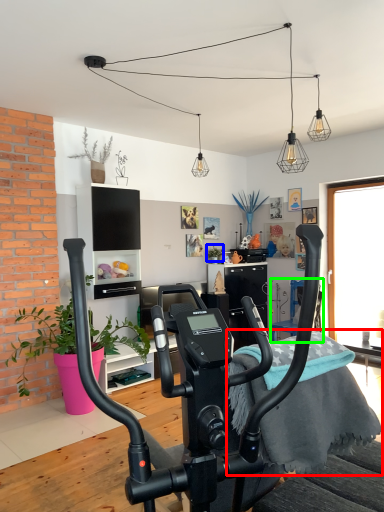
Question: Which object is positioned farthest from bedding (highlighted by a red box)? Select from plant (highlighted by a blue box) and armchair (highlighted by a green box).

Choices:
 (A) plant
 (B) armchair

Answer: (A)